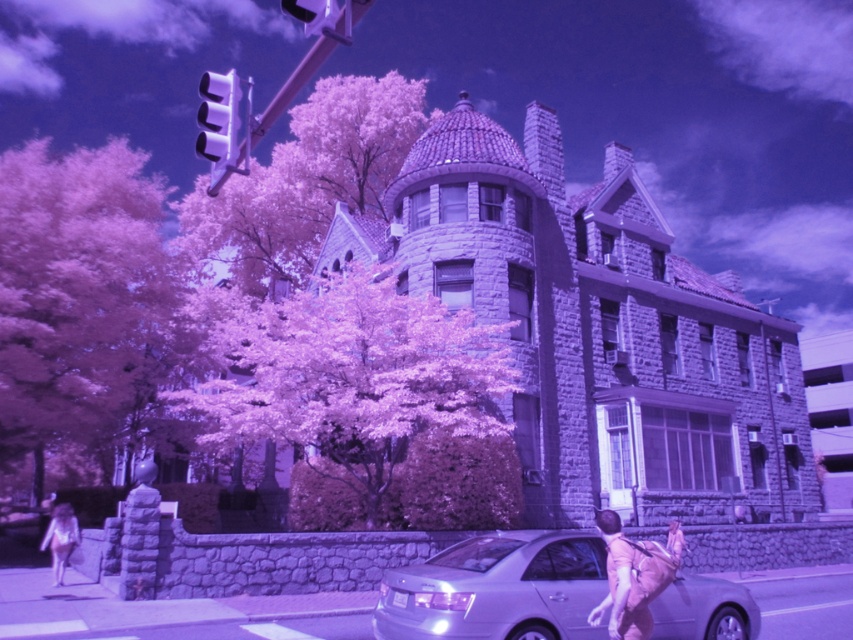
You are a photographer standing in front of the historic building. You want to take a photo of the white cotton dress at lower left without the purple leafy tree at upper center blocking the view. Is this possible?

The white cotton dress at lower left is behind the purple leafy tree at upper center, so it would be blocked from view. Move to a position where the dress is not obscured by the tree.

You are a photographer trying to capture a wide shot of the purple leafy tree at left and the satin silver sedan at lower center. Based on their sizes, which object will occupy more space in your photo?

The purple leafy tree at left will occupy more space in the photo because its width is larger than that of the satin silver sedan at lower center.